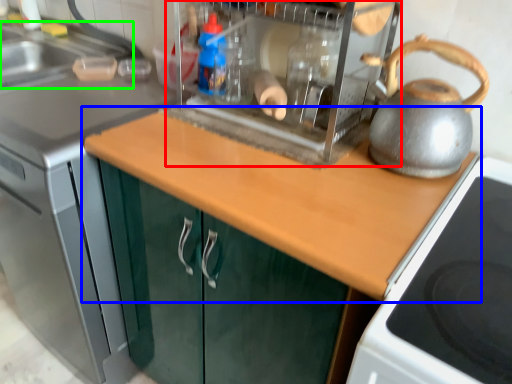
Question: Which object is the farthest from appliance (highlighted by a red box)? Choose among these: countertop (highlighted by a blue box) or sink (highlighted by a green box).

Choices:
 (A) countertop
 (B) sink

Answer: (B)